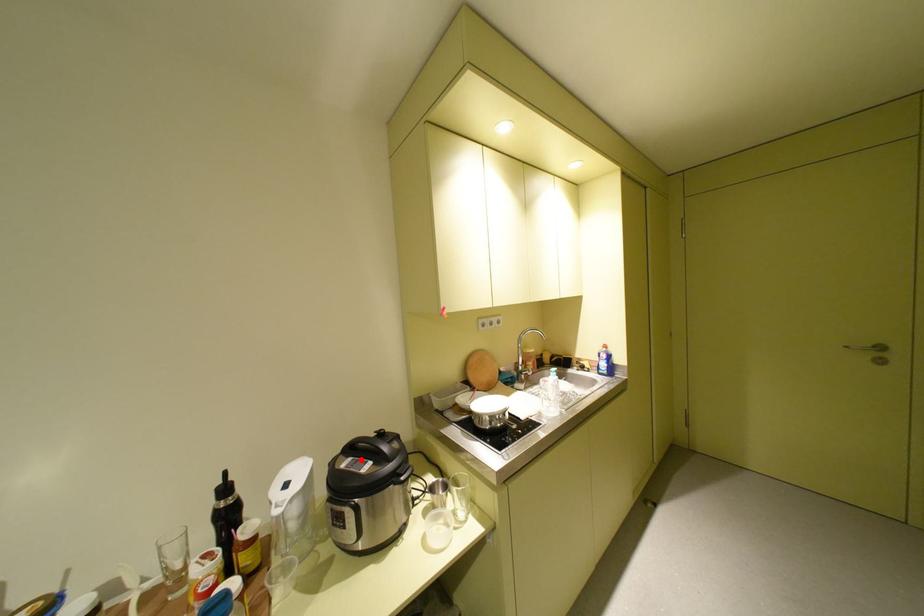
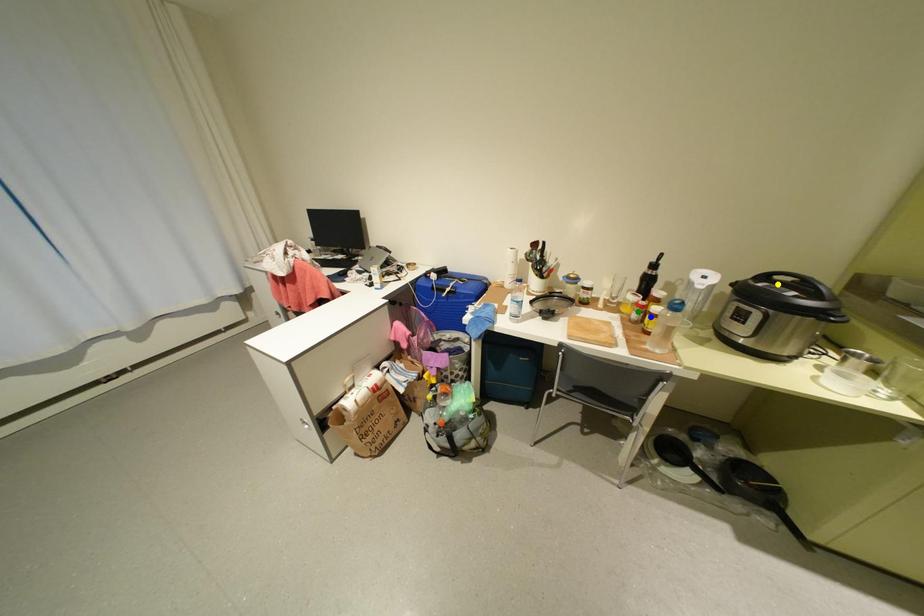
Question: I am providing you with two images of the same scene from different viewpoints. A red point is marked on the first image. You are given multiple points on the second image. Which mark in image 2 goes with the point in image 1?

Choices:
 (A) blue point
 (B) green point
 (C) yellow point

Answer: (C)